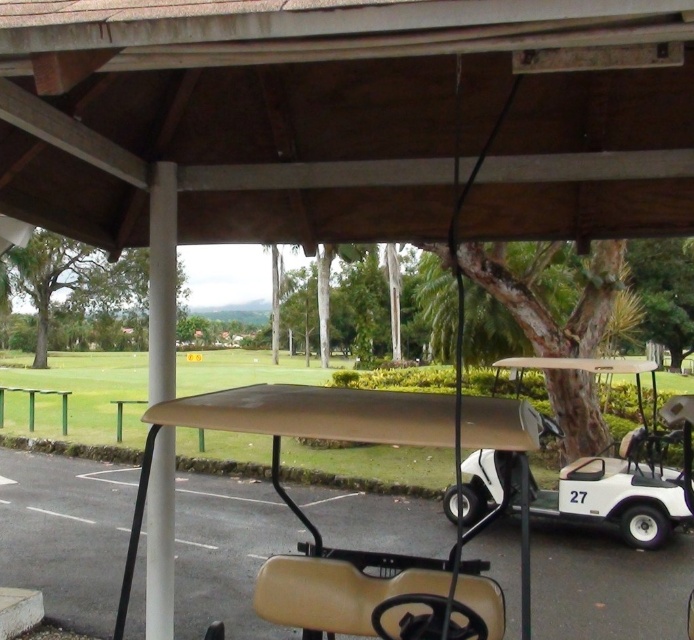
Consider the image. Can you confirm if beige matte golf cart at center is taller than white matte golf cart at center?

Correct, beige matte golf cart at center is much taller as white matte golf cart at center.

Describe the element at coordinates (362, 550) in the screenshot. I see `beige matte golf cart at center` at that location.

Find the location of `beige matte golf cart at center`. beige matte golf cart at center is located at coordinates (362, 550).